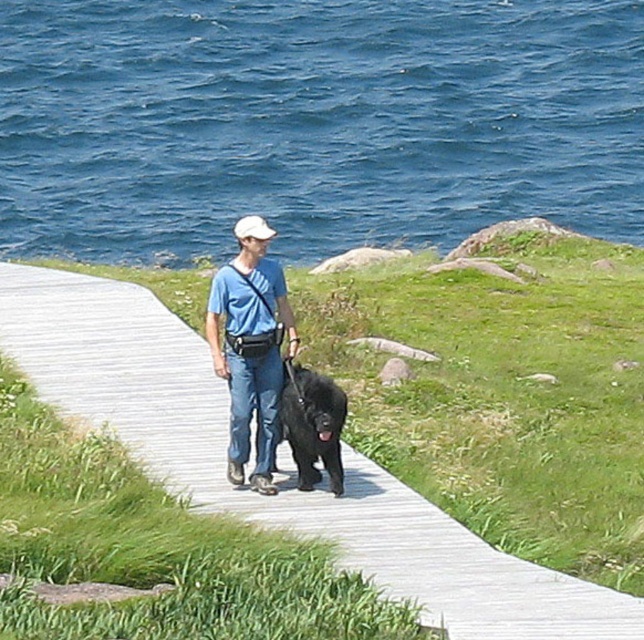
Which is behind, point (468, 195) or point (243, 230)?

The point (468, 195) is more distant.

Find the location of `blue water at upper center`. blue water at upper center is located at coordinates (314, 122).

Is blue water at upper center smaller than black fluffy dog at center?

No, blue water at upper center is not smaller than black fluffy dog at center.

Is blue water at upper center positioned at the back of black fluffy dog at center?

Yes, blue water at upper center is behind black fluffy dog at center.

Image resolution: width=644 pixels, height=640 pixels. What do you see at coordinates (314, 122) in the screenshot?
I see `blue water at upper center` at bounding box center [314, 122].

Where is `blue water at upper center`? The height and width of the screenshot is (640, 644). blue water at upper center is located at coordinates tap(314, 122).

Is point (289, 506) less distant than point (254, 465)?

Yes, it is.

Identify the location of wooden boardwalk at center. This screenshot has height=640, width=644. (285, 490).